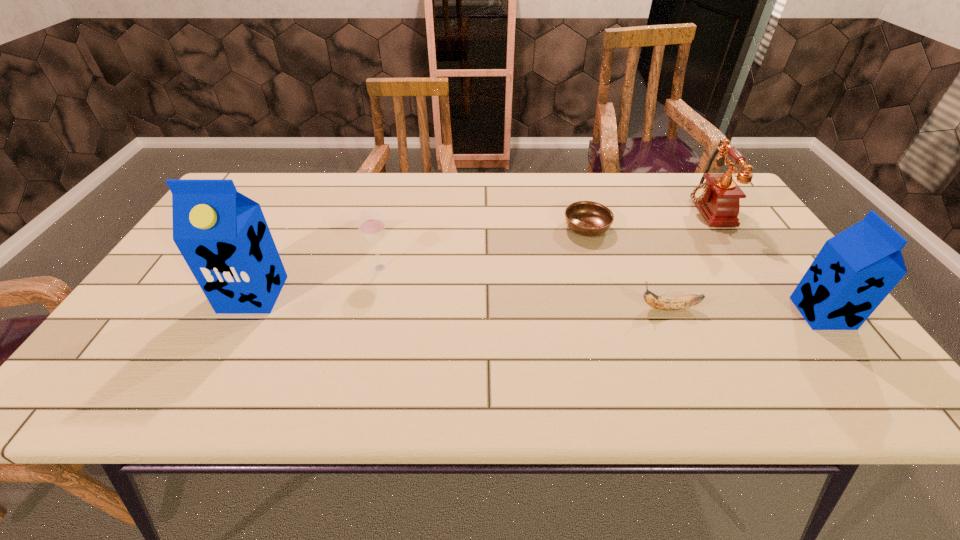
Where is `telephone that is positioned at the far edge`? The width and height of the screenshot is (960, 540). telephone that is positioned at the far edge is located at coordinates point(718,199).

This screenshot has height=540, width=960. In order to click on object located in the near edge section of the desktop in this screenshot , I will do `click(855, 270)`.

I want to click on carton that is at the right edge, so click(855, 270).

The height and width of the screenshot is (540, 960). In order to click on telephone situated at the right edge in this screenshot , I will do [x=718, y=199].

Where is `object at the far right corner`? This screenshot has width=960, height=540. object at the far right corner is located at coordinates (718, 199).

Where is `object located in the near right corner section of the desktop`? The width and height of the screenshot is (960, 540). object located in the near right corner section of the desktop is located at coordinates (855, 270).

The image size is (960, 540). What are the coordinates of `free space at the far edge` in the screenshot? It's located at (582, 179).

Locate an element on the screen. free location at the near edge is located at coordinates (634, 332).

Locate an element on the screen. Image resolution: width=960 pixels, height=540 pixels. vacant space at the left edge of the desktop is located at coordinates (151, 299).

I want to click on vacant space at the far left corner of the desktop, so click(270, 209).